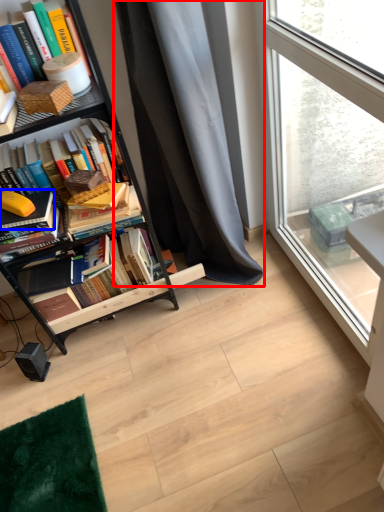
Question: Which object is further to the camera taking this photo, curtain (highlighted by a red box) or book (highlighted by a blue box)?

Choices:
 (A) curtain
 (B) book

Answer: (B)